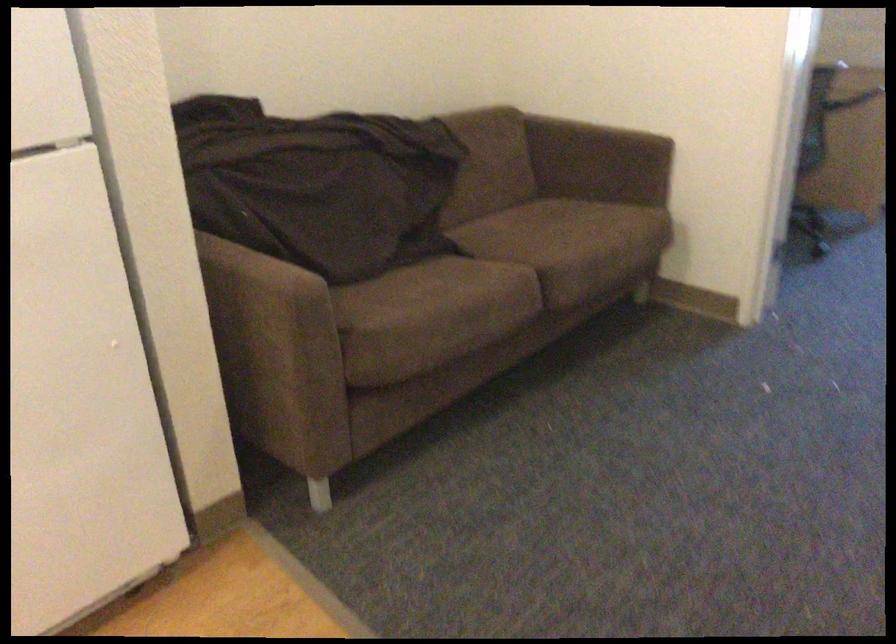
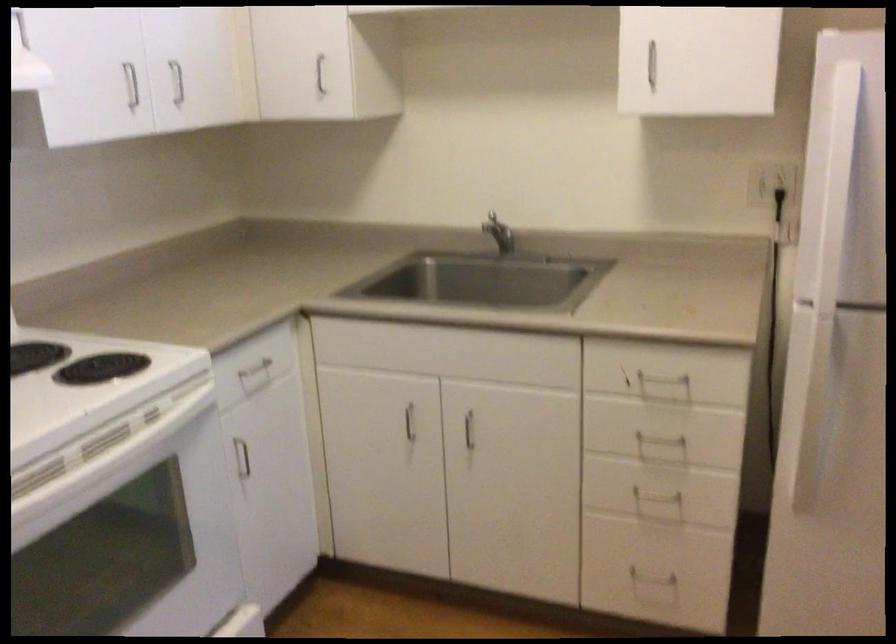
Question: The first image is from the beginning of the video and the second image is from the end. How did the camera likely rotate when shooting the video?

Choices:
 (A) Left
 (B) Right
 (C) Up
 (D) Down

Answer: (A)